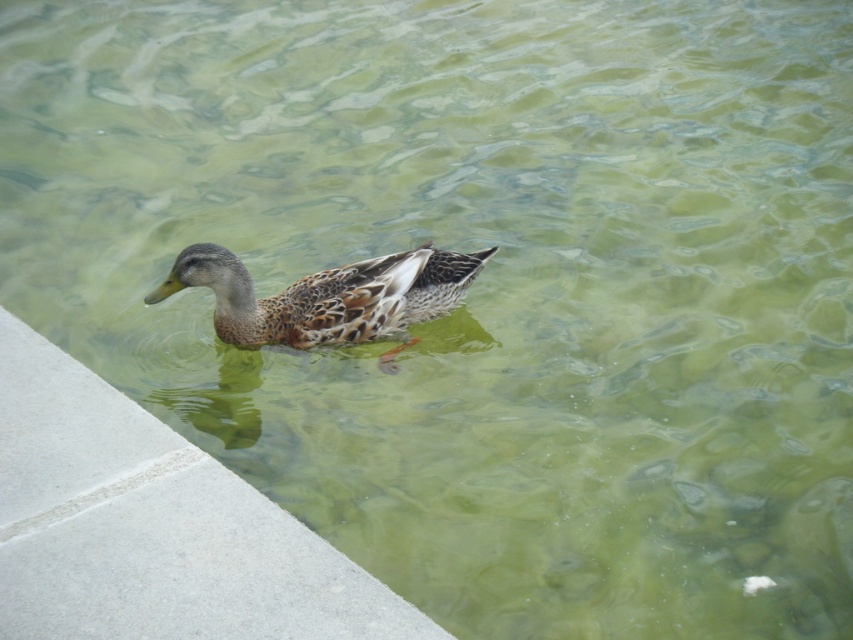
Does gray concrete ledge at lower left have a greater height compared to brown speckled duck at center?

Yes.

Does gray concrete ledge at lower left lie in front of brown speckled duck at center?

Yes, it is in front of brown speckled duck at center.

Is point (142, 451) in front of point (172, 268)?

That is True.

The width and height of the screenshot is (853, 640). In order to click on gray concrete ledge at lower left in this screenshot , I will do `click(152, 525)`.